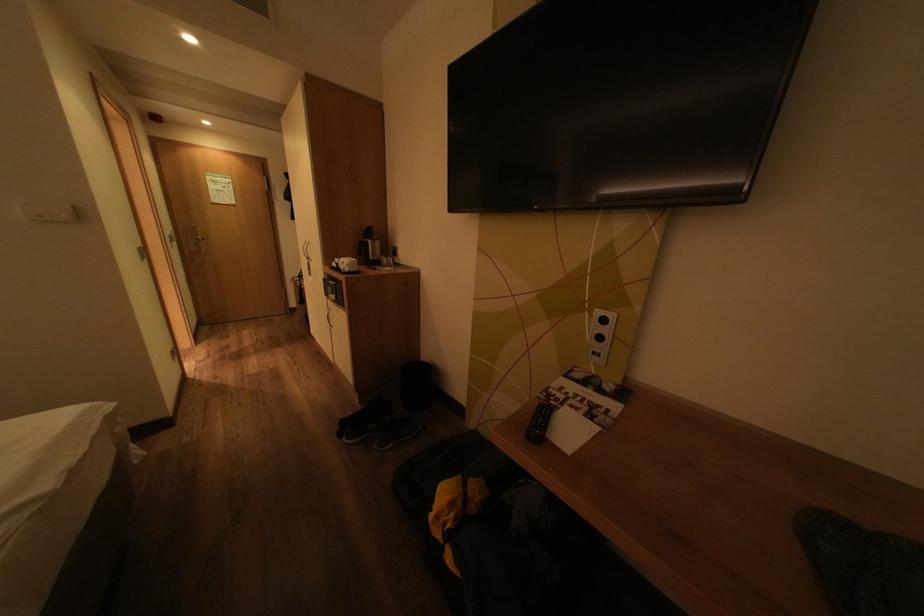
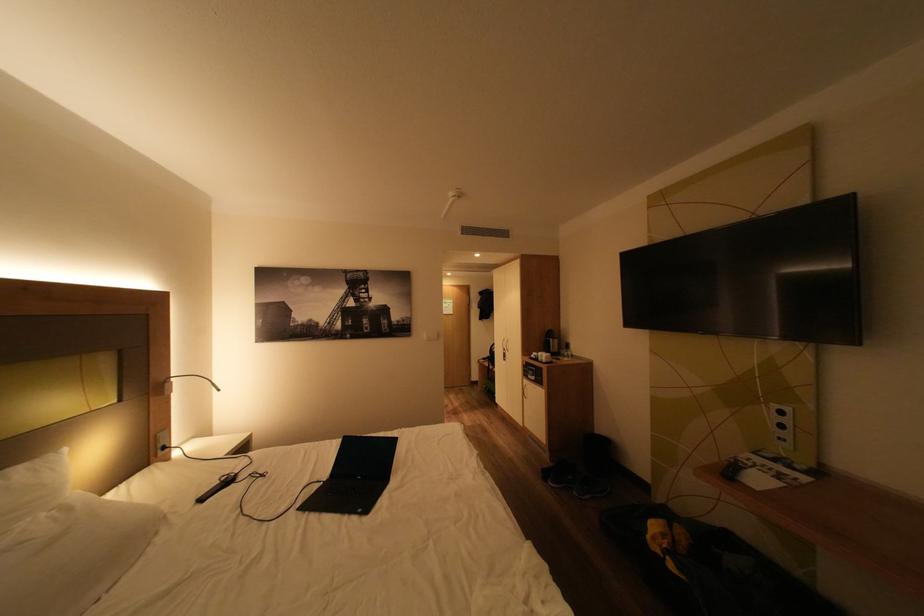
Locate, in the second image, the point that corresponds to the point at 369,403 in the first image.

(560, 461)